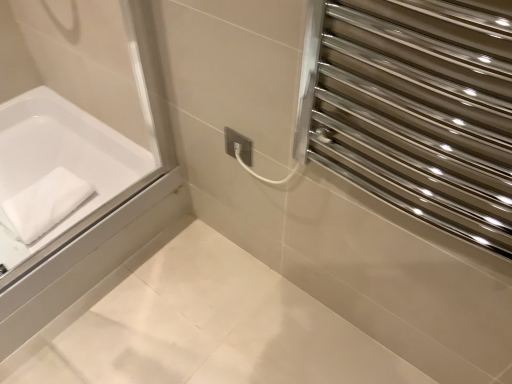
Describe the element at coordinates (418, 109) in the screenshot. This screenshot has height=384, width=512. I see `polished stainless steel towel rack at upper right` at that location.

What do you see at coordinates (57, 171) in the screenshot?
I see `white matte bathtub at left` at bounding box center [57, 171].

The width and height of the screenshot is (512, 384). What do you see at coordinates (42, 204) in the screenshot?
I see `white soft towel at left` at bounding box center [42, 204].

Identify the location of polished stainless steel towel rack at upper right. Image resolution: width=512 pixels, height=384 pixels. (418, 109).

Can you confirm if polished stainless steel towel rack at upper right is shorter than white soft towel at left?

Incorrect, the height of polished stainless steel towel rack at upper right does not fall short of that of white soft towel at left.

Locate an element on the screen. This screenshot has width=512, height=384. screen door to the right of white soft towel at left is located at coordinates (418, 109).

Considering the positions of point (385, 1) and point (41, 204), is point (385, 1) closer or farther from the camera than point (41, 204)?

Point (385, 1) is closer to the camera than point (41, 204).

From the image's perspective, is polished stainless steel towel rack at upper right above or below white soft towel at left?

polished stainless steel towel rack at upper right is above white soft towel at left.

Is white soft towel at left turned away from white matte bathtub at left?

Correct, white soft towel at left is looking away from white matte bathtub at left.

From a real-world perspective, relative to white matte bathtub at left, is white soft towel at left vertically above or below?

From a real-world perspective, white soft towel at left is physically above white matte bathtub at left.

In the scene shown: Which of these two, white soft towel at left or white matte bathtub at left, is smaller?

With smaller size is white soft towel at left.

This screenshot has width=512, height=384. In order to click on bathtub to the left of white soft towel at left in this screenshot , I will do `click(57, 171)`.

Between polished stainless steel towel rack at upper right and white matte bathtub at left, which one has smaller size?

Smaller between the two is polished stainless steel towel rack at upper right.

From the image's perspective, is polished stainless steel towel rack at upper right on top of white matte bathtub at left?

Incorrect, from the image's perspective, polished stainless steel towel rack at upper right is lower than white matte bathtub at left.

Which of these two, polished stainless steel towel rack at upper right or white matte bathtub at left, stands shorter?

white matte bathtub at left is shorter.

Is polished stainless steel towel rack at upper right turned away from white matte bathtub at left?

No.

From a real-world perspective, which object rests below the other?

From a 3D spatial view, white soft towel at left is below.

The width and height of the screenshot is (512, 384). Find the location of `screen door in front of the white soft towel at left`. screen door in front of the white soft towel at left is located at coordinates (418, 109).

Is polished stainless steel towel rack at upper right a part of white soft towel at left?

No, white soft towel at left does not contain polished stainless steel towel rack at upper right.

Considering the sizes of objects white soft towel at left and polished stainless steel towel rack at upper right in the image provided, who is bigger, white soft towel at left or polished stainless steel towel rack at upper right?

With larger size is polished stainless steel towel rack at upper right.

Which is correct: white matte bathtub at left is inside polished stainless steel towel rack at upper right, or outside of it?

white matte bathtub at left is not inside polished stainless steel towel rack at upper right, it's outside.

In the scene shown: Considering the sizes of objects white matte bathtub at left and polished stainless steel towel rack at upper right in the image provided, who is wider, white matte bathtub at left or polished stainless steel towel rack at upper right?

white matte bathtub at left is wider.

Looking at this image, is the depth of white matte bathtub at left less than that of polished stainless steel towel rack at upper right?

No, white matte bathtub at left is further to the viewer.

Who is smaller, white matte bathtub at left or white soft towel at left?

Smaller between the two is white soft towel at left.

From the image's perspective, is white matte bathtub at left located beneath white soft towel at left?

Actually, white matte bathtub at left appears above white soft towel at left in the image.

Is white matte bathtub at left taller than white soft towel at left?

Indeed, white matte bathtub at left has a greater height compared to white soft towel at left.

Can you confirm if white matte bathtub at left is positioned to the left of white soft towel at left?

Yes.

Where is `bath towel that is behind the polished stainless steel towel rack at upper right`? Image resolution: width=512 pixels, height=384 pixels. bath towel that is behind the polished stainless steel towel rack at upper right is located at coordinates [42, 204].

The height and width of the screenshot is (384, 512). What are the coordinates of `bath towel that appears below the white matte bathtub at left (from the image's perspective)` in the screenshot? It's located at (42, 204).

In the scene shown: Considering their positions, is white matte bathtub at left positioned closer to white soft towel at left than polished stainless steel towel rack at upper right?

The object closer to white soft towel at left is white matte bathtub at left.

Which object lies nearer to the anchor point white matte bathtub at left, polished stainless steel towel rack at upper right or white soft towel at left?

white soft towel at left is closer to white matte bathtub at left.

Considering their positions, is polished stainless steel towel rack at upper right positioned further to white soft towel at left than white matte bathtub at left?

polished stainless steel towel rack at upper right lies further to white soft towel at left than the other object.

Considering their positions, is white matte bathtub at left positioned closer to polished stainless steel towel rack at upper right than white soft towel at left?

The object closer to polished stainless steel towel rack at upper right is white matte bathtub at left.

Estimate the real-world distances between objects in this image. Which object is closer to polished stainless steel towel rack at upper right, white soft towel at left or white matte bathtub at left?

white matte bathtub at left lies closer to polished stainless steel towel rack at upper right than the other object.

From the image, which object appears to be farther from white matte bathtub at left, white soft towel at left or polished stainless steel towel rack at upper right?

polished stainless steel towel rack at upper right.

The width and height of the screenshot is (512, 384). I want to click on bath towel between white matte bathtub at left and polished stainless steel towel rack at upper right in the horizontal direction, so (x=42, y=204).